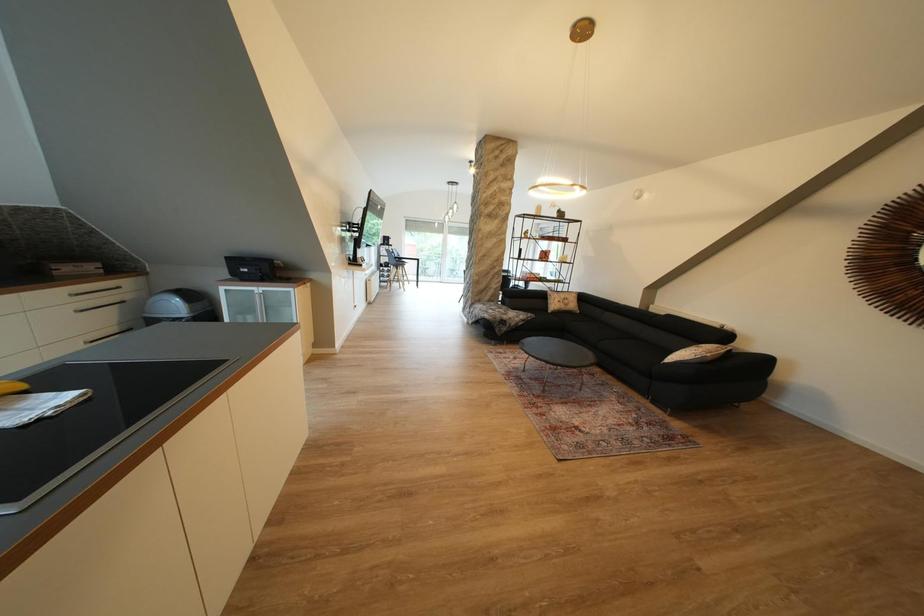
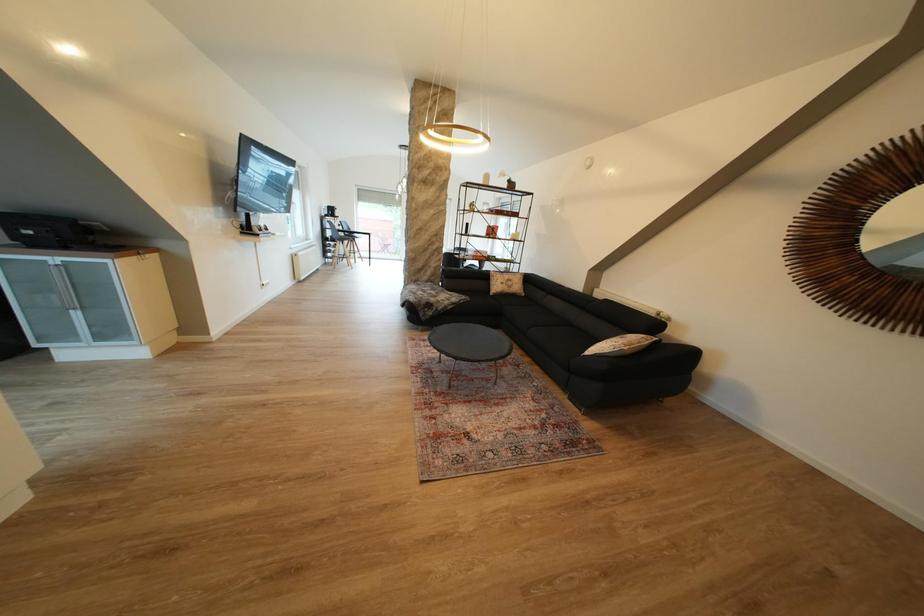
Question: The first image is from the beginning of the video and the second image is from the end. How did the camera likely rotate when shooting the video?

Choices:
 (A) Left
 (B) Right
 (C) Up
 (D) Down

Answer: (D)